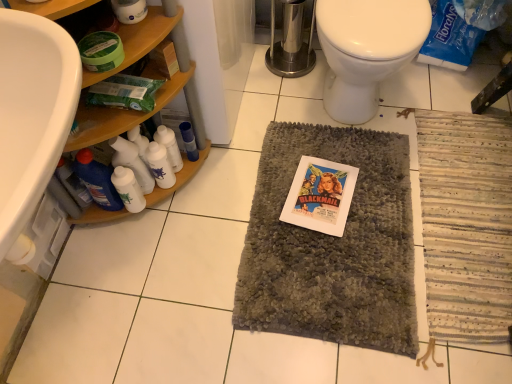
Where is `blank space above striped fabric bath mat at lower right (from a real-world perspective)`? This screenshot has width=512, height=384. blank space above striped fabric bath mat at lower right (from a real-world perspective) is located at coordinates (473, 218).